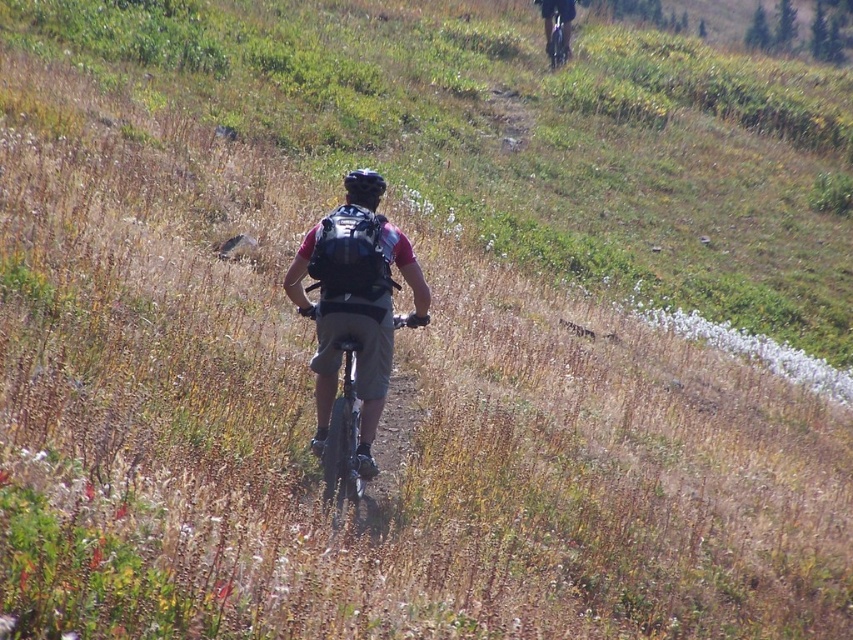
You are a photographer trying to capture the cyclist from behind. You notice the matte black backpack at upper center and the matte black helmet at center. Which object is positioned more to the right when focusing on the cyclist?

The matte black backpack at upper center is positioned to the right of the matte black helmet at center, so the backpack is more to the right.